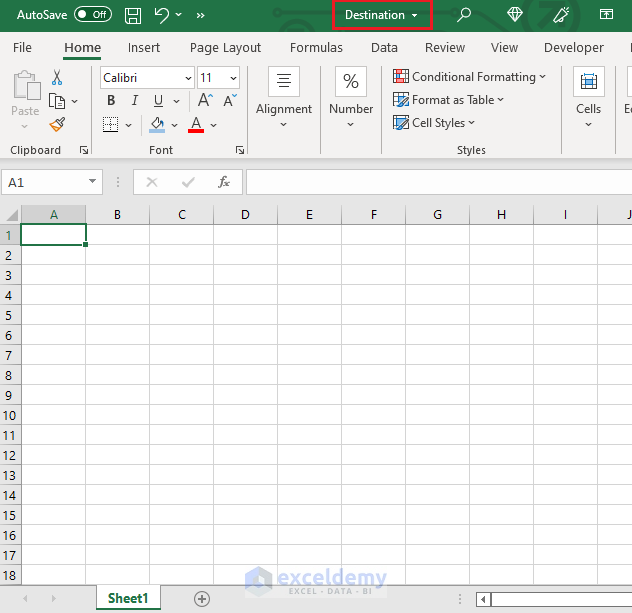
The image size is (632, 613). What are the coordinates of `columns` in the screenshot? It's located at (43, 219), (124, 215), (183, 215), (258, 211), (318, 216), (367, 213), (427, 210), (489, 211), (553, 211), (626, 211).